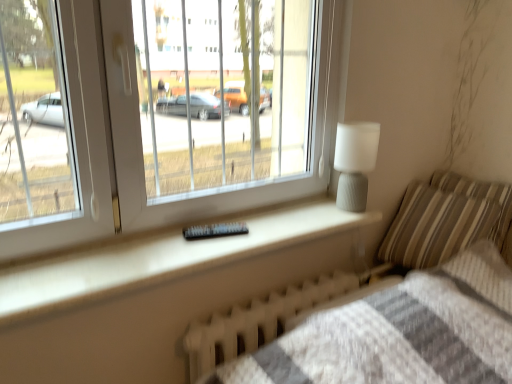
Question: From a real-world perspective, is striped fabric pillow at right, which is the second pillow from right to left, under white matte lamp at upper right?

Choices:
 (A) yes
 (B) no

Answer: (A)

Question: Is striped fabric pillow at right, which is the second pillow from right to left, facing towards white matte lamp at upper right?

Choices:
 (A) yes
 (B) no

Answer: (A)

Question: Is striped fabric pillow at right, arranged as the first pillow when viewed from the left, closer to the viewer compared to white matte lamp at upper right?

Choices:
 (A) no
 (B) yes

Answer: (A)

Question: From the image's perspective, would you say striped fabric pillow at right, which is the second pillow from right to left, is positioned over white matte lamp at upper right?

Choices:
 (A) no
 (B) yes

Answer: (A)

Question: Is striped fabric pillow at right, arranged as the first pillow when viewed from the left, wider than white matte lamp at upper right?

Choices:
 (A) yes
 (B) no

Answer: (A)

Question: Looking at their shapes, would you say white textured radiator at lower center is wider or thinner than white plastic window at upper left?

Choices:
 (A) wide
 (B) thin

Answer: (B)

Question: From a real-world perspective, is white textured radiator at lower center above or below white plastic window at upper left?

Choices:
 (A) above
 (B) below

Answer: (B)

Question: Considering the positions of white textured radiator at lower center and white plastic window at upper left in the image, is white textured radiator at lower center taller or shorter than white plastic window at upper left?

Choices:
 (A) short
 (B) tall

Answer: (A)

Question: Is white textured radiator at lower center situated inside white plastic window at upper left or outside?

Choices:
 (A) inside
 (B) outside

Answer: (B)

Question: From the image's perspective, is white matte lamp at upper right above or below striped fabric pillow at right, which is the second pillow from right to left?

Choices:
 (A) below
 (B) above

Answer: (B)

Question: Considering the positions of white matte lamp at upper right and striped fabric pillow at right, arranged as the first pillow when viewed from the left, in the image, is white matte lamp at upper right wider or thinner than striped fabric pillow at right, arranged as the first pillow when viewed from the left,?

Choices:
 (A) wide
 (B) thin

Answer: (B)

Question: Is point (367, 147) closer or farther from the camera than point (461, 205)?

Choices:
 (A) closer
 (B) farther

Answer: (A)

Question: Is white matte lamp at upper right taller or shorter than striped fabric pillow at right, which is the second pillow from right to left?

Choices:
 (A) tall
 (B) short

Answer: (B)

Question: Is white textured radiator at lower center in front of or behind striped fabric pillow at right, arranged as the 2th pillow when viewed from the left, in the image?

Choices:
 (A) front
 (B) behind

Answer: (A)

Question: Considering the positions of white textured radiator at lower center and striped fabric pillow at right, arranged as the 2th pillow when viewed from the left, in the image, is white textured radiator at lower center wider or thinner than striped fabric pillow at right, arranged as the 2th pillow when viewed from the left,?

Choices:
 (A) thin
 (B) wide

Answer: (A)